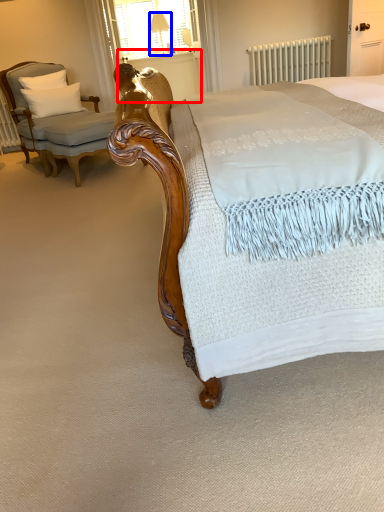
Question: Among these objects, which one is farthest to the camera, balustrade (highlighted by a red box) or table lamp (highlighted by a blue box)?

Choices:
 (A) balustrade
 (B) table lamp

Answer: (B)